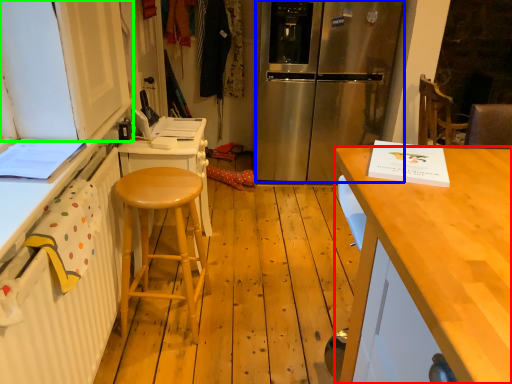
Question: Based on their relative distances, which object is farther from desk (highlighted by a red box)? Choose from refrigerator (highlighted by a blue box) and cabinetry (highlighted by a green box).

Choices:
 (A) refrigerator
 (B) cabinetry

Answer: (A)